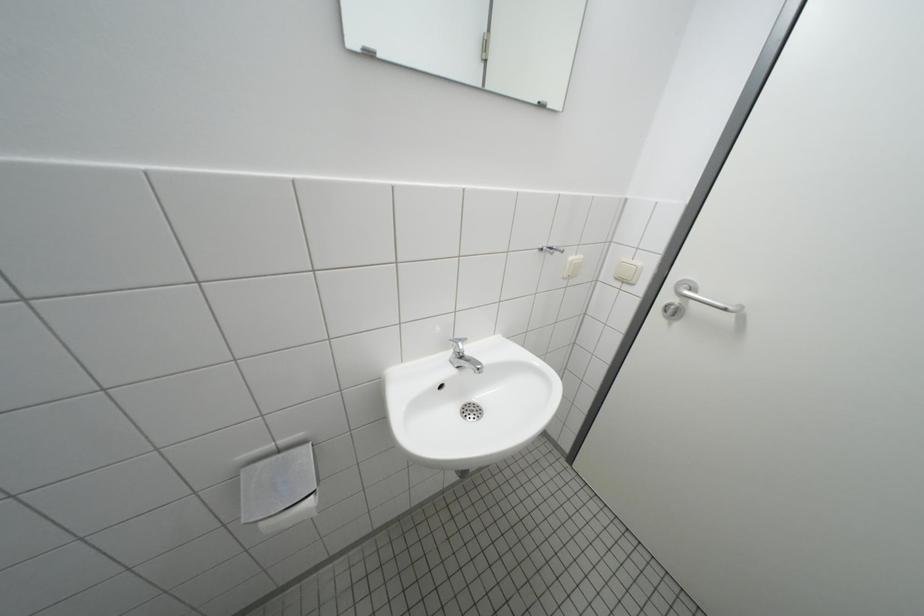
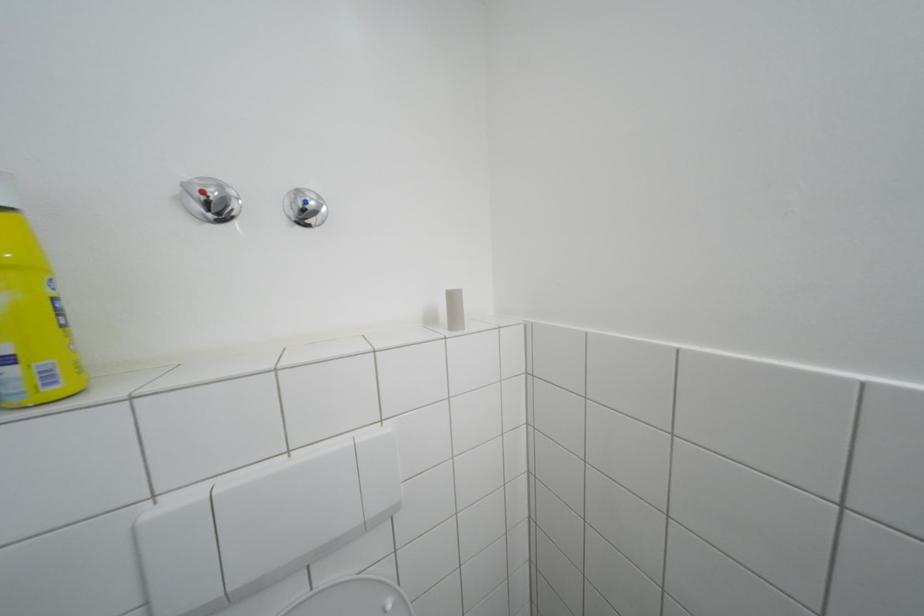
Question: Based on the continuous images, in which direction is the camera rotating? Reply with the corresponding letter.

Choices:
 (A) Left
 (B) Right
 (C) Up
 (D) Down

Answer: (A)